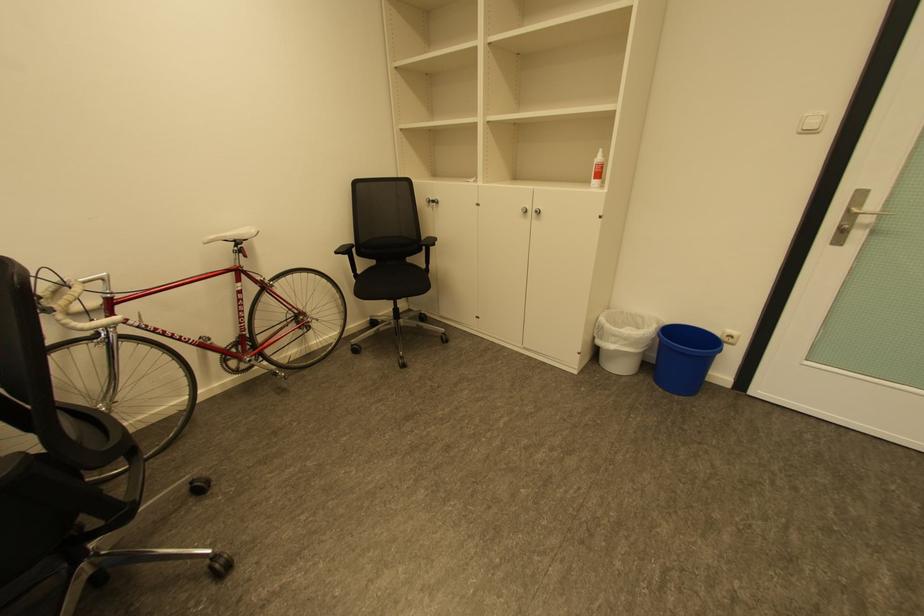
What do you see at coordinates (730, 336) in the screenshot? Image resolution: width=924 pixels, height=616 pixels. I see `the light switch` at bounding box center [730, 336].